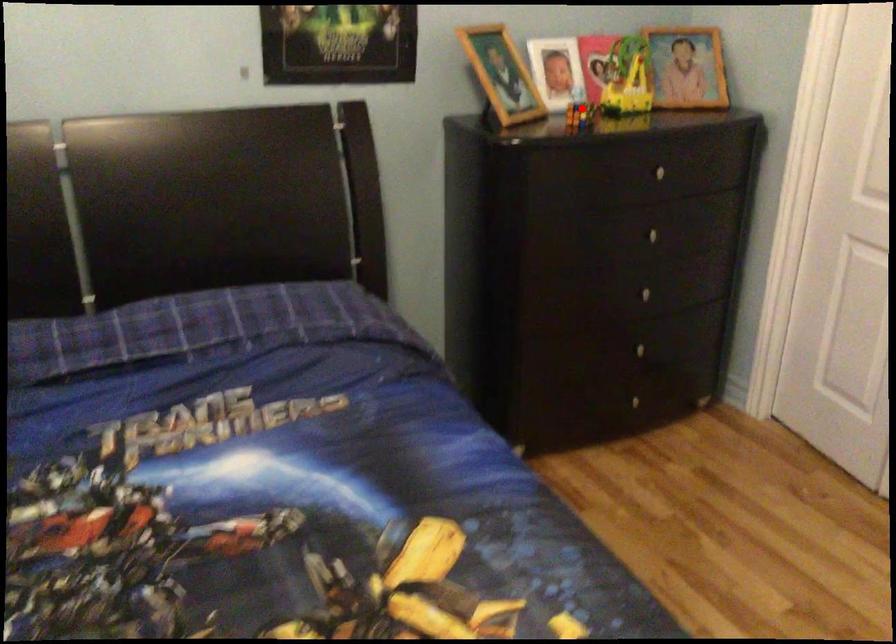
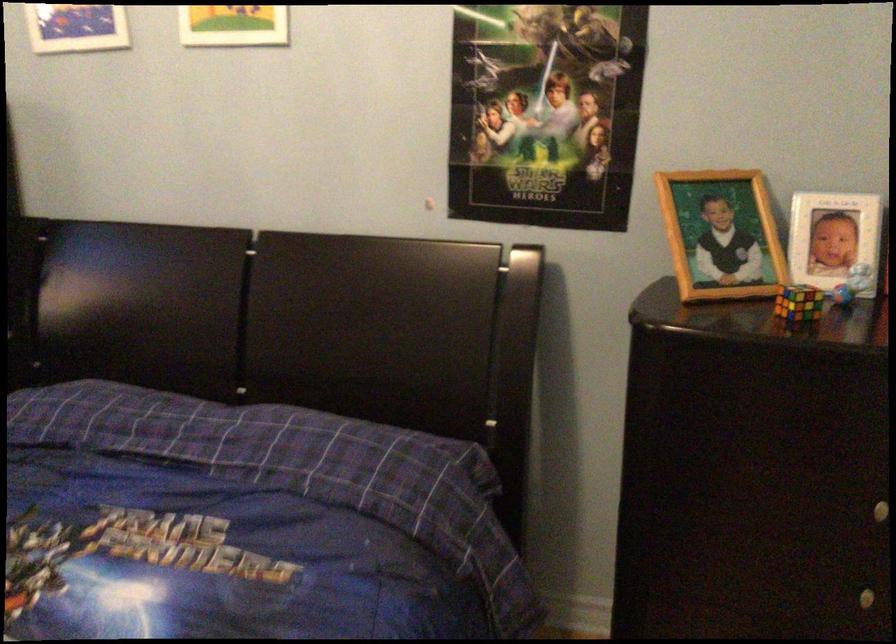
The point at the highlighted location is marked in the first image. Where is the corresponding point in the second image?

(798, 303)